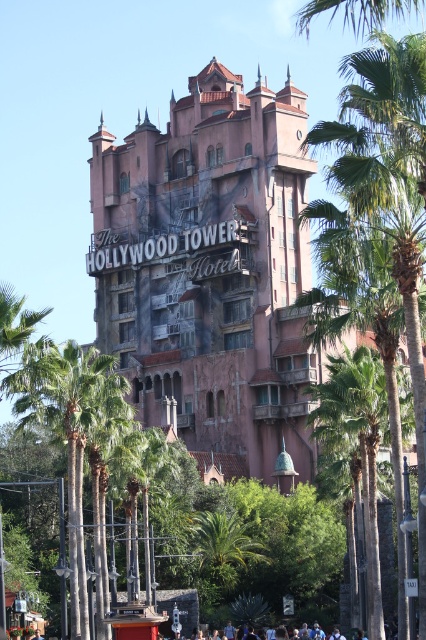
Question: Does pink textured building at center have a smaller size compared to green leafy palm tree at center?

Choices:
 (A) no
 (B) yes

Answer: (A)

Question: Is pink textured building at center smaller than light blue shirt at lower center?

Choices:
 (A) no
 (B) yes

Answer: (A)

Question: Which object is closer to the camera taking this photo?

Choices:
 (A) light blue shirt at lower center
 (B) green leafy palm tree at center

Answer: (B)

Question: Which of these objects is positioned closest to the green leafy palm tree at center?

Choices:
 (A) light blue shirt at lower center
 (B) pink textured building at center

Answer: (A)

Question: Considering the relative positions of pink textured building at center and green leafy palm tree at center in the image provided, where is pink textured building at center located with respect to green leafy palm tree at center?

Choices:
 (A) right
 (B) left

Answer: (B)

Question: Which object appears closest to the camera in this image?

Choices:
 (A) pink textured building at center
 (B) green leafy palm tree at center

Answer: (B)